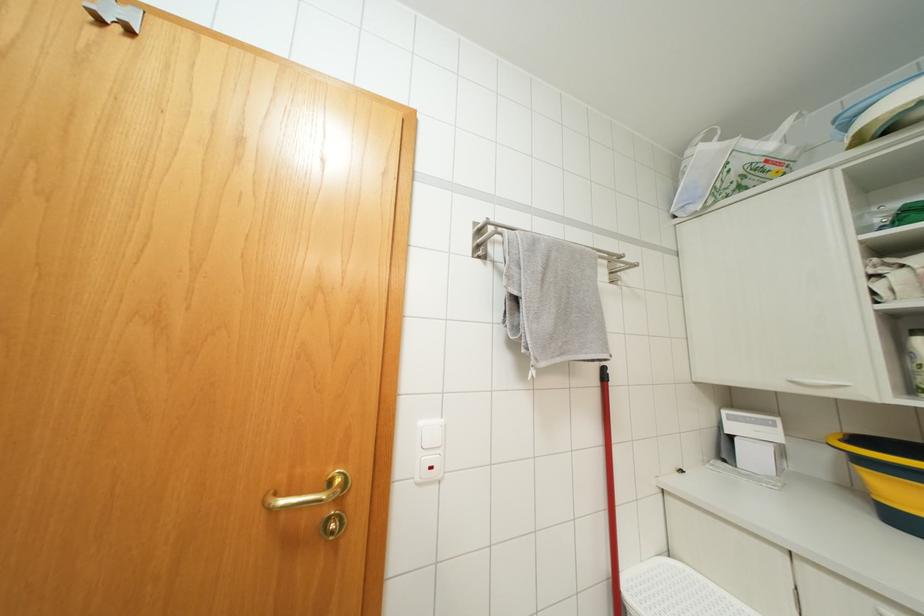
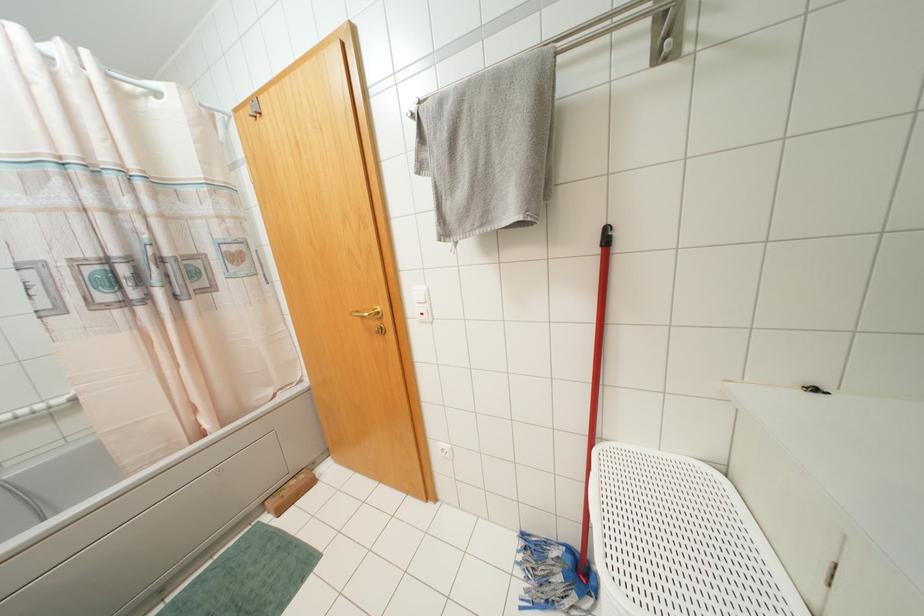
Locate, in the second image, the point that corresponds to (x=602, y=369) in the first image.

(606, 229)